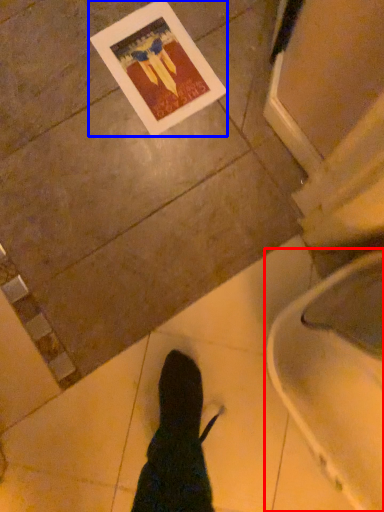
Question: Which object is closer to the camera taking this photo, toilet (highlighted by a red box) or postcard (highlighted by a blue box)?

Choices:
 (A) toilet
 (B) postcard

Answer: (A)